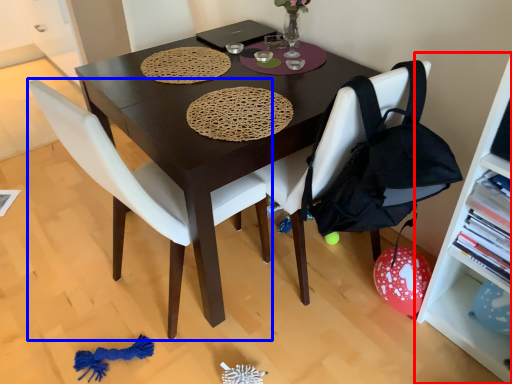
Question: Which object is further to the camera taking this photo, shelf (highlighted by a red box) or chair (highlighted by a blue box)?

Choices:
 (A) shelf
 (B) chair

Answer: (B)